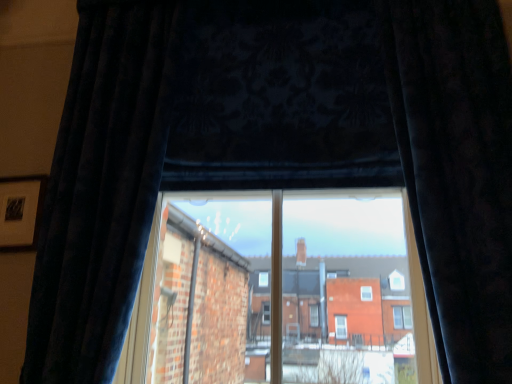
Question: Is point coord(81,14) positioned closer to the camera than point coord(499,99)?

Choices:
 (A) closer
 (B) farther

Answer: (B)

Question: Visually, is velvet dark blue curtain at left, which is the second curtain in right-to-left order, positioned to the left or to the right of velvet dark blue curtain at right, the first curtain in the right-to-left sequence?

Choices:
 (A) right
 (B) left

Answer: (B)

Question: From a real-world perspective, relative to velvet dark blue curtain at right, the first curtain in the right-to-left sequence, is velvet dark blue curtain at left, which is the second curtain in right-to-left order, vertically above or below?

Choices:
 (A) above
 (B) below

Answer: (A)

Question: Is point (510, 238) positioned closer to the camera than point (125, 72)?

Choices:
 (A) farther
 (B) closer

Answer: (B)

Question: In the image, is velvet dark blue curtain at right, the first curtain in the right-to-left sequence, positioned in front of or behind velvet dark blue curtain at left, the first curtain from the left?

Choices:
 (A) front
 (B) behind

Answer: (A)

Question: From a real-world perspective, is velvet dark blue curtain at right, the second curtain when ordered from left to right, physically located above or below velvet dark blue curtain at left, the first curtain from the left?

Choices:
 (A) above
 (B) below

Answer: (B)

Question: Looking at their shapes, would you say velvet dark blue curtain at right, the second curtain when ordered from left to right, is wider or thinner than velvet dark blue curtain at left, which is the second curtain in right-to-left order?

Choices:
 (A) wide
 (B) thin

Answer: (A)